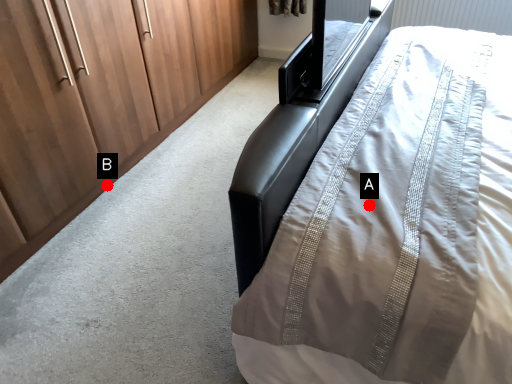
Question: Two points are circled on the image, labeled by A and B beside each circle. Which of the following is the closest to the observer?

Choices:
 (A) A is closer
 (B) B is closer

Answer: (A)